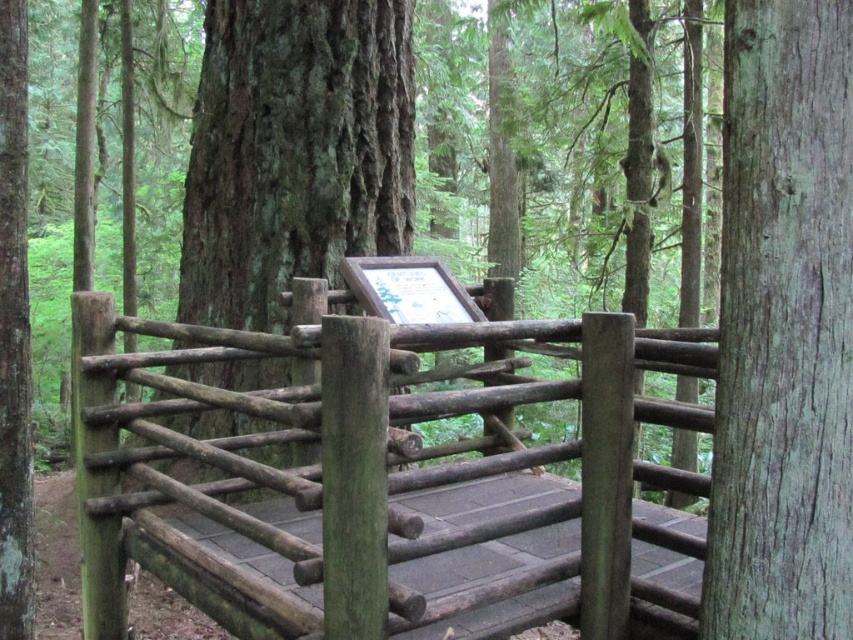
Does point (235, 128) come closer to viewer compared to point (19, 243)?

No, (235, 128) is behind (19, 243).

The width and height of the screenshot is (853, 640). What do you see at coordinates (294, 150) in the screenshot? I see `green rough bark tree at center` at bounding box center [294, 150].

At what (x,y) coordinates should I click in order to perform the action: click on green rough bark tree at center. Please return your answer as a coordinate pair (x, y). Looking at the image, I should click on (294, 150).

Does gray rough wood at right lie behind green rough bark tree at center?

No, it is in front of green rough bark tree at center.

Is gray rough wood at right below green rough bark tree at center?

Correct, gray rough wood at right is located below green rough bark tree at center.

The image size is (853, 640). What do you see at coordinates (782, 328) in the screenshot? I see `gray rough wood at right` at bounding box center [782, 328].

The width and height of the screenshot is (853, 640). In order to click on gray rough wood at right in this screenshot , I will do `click(782, 328)`.

Can you confirm if green wood fence at center is positioned to the left of green rough bark tree at center?

In fact, green wood fence at center is to the right of green rough bark tree at center.

Which is behind, point (611, 413) or point (247, 323)?

Point (247, 323)

Does point (550, 609) come farther from viewer compared to point (387, 97)?

No, it is in front of (387, 97).

The image size is (853, 640). I want to click on green wood fence at center, so click(x=372, y=483).